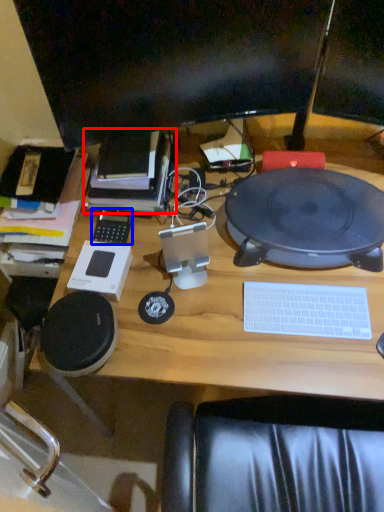
Question: Which object is further to the camera taking this photo, book (highlighted by a red box) or gadget (highlighted by a blue box)?

Choices:
 (A) book
 (B) gadget

Answer: (B)